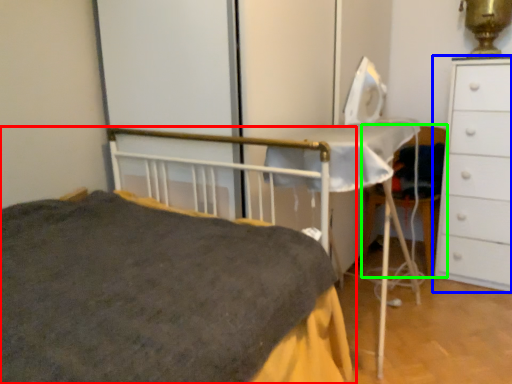
Question: Estimate the real-world distances between objects in this image. Which object is closer to bed (highlighted by a red box), chest of drawers (highlighted by a blue box) or chair (highlighted by a green box)?

Choices:
 (A) chest of drawers
 (B) chair

Answer: (A)